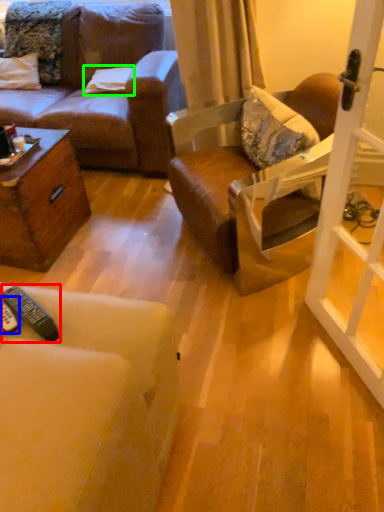
Question: Which object is the closest to the remote control (highlighted by a red box)? Choose among these: remote control (highlighted by a blue box) or pillow (highlighted by a green box).

Choices:
 (A) remote control
 (B) pillow

Answer: (A)